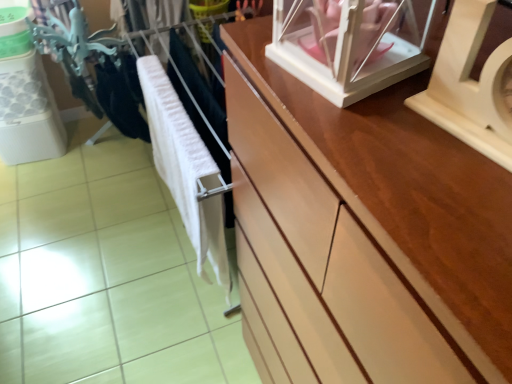
Question: Is wooden clock at upper right spatially inside white glossy glass box at upper right, or outside of it?

Choices:
 (A) inside
 (B) outside

Answer: (B)

Question: From the image's perspective, is wooden clock at upper right located above or below white glossy glass box at upper right?

Choices:
 (A) above
 (B) below

Answer: (B)

Question: Which is farther from the white soft cloth at center?

Choices:
 (A) wooden clock at upper right
 (B) white glossy glass box at upper right

Answer: (A)

Question: Based on their relative distances, which object is farther from the wooden clock at upper right?

Choices:
 (A) white soft cloth at center
 (B) white glossy glass box at upper right

Answer: (A)